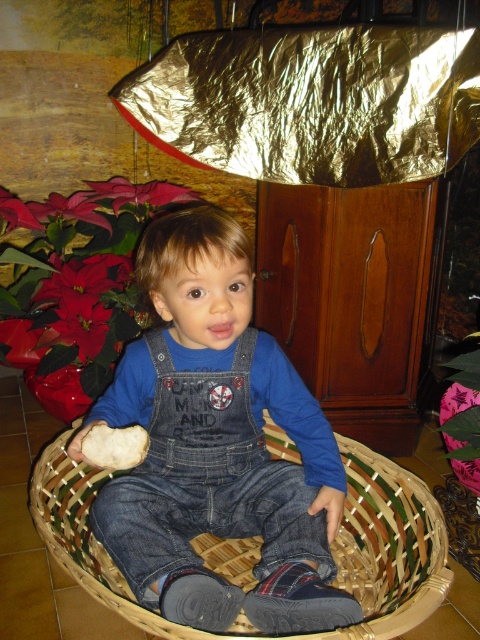
Based on the scene description, where is the denim overalls at center located in terms of coordinates?

The denim overalls at center is located at point coordinates of (216, 445).

You are a parent looking at the image and want to ensure the child is safe. Since the child is in the woven wood basket at center and wearing denim overalls at center, which object is closer to you to check if the child is secure?

The denim overalls at center is closer to you than the woven wood basket at center, so you should check the denim overalls at center first to ensure the child is secure.

You are a photographer setting up a shot of the child in the woven wood basket at center. The denim overalls at center are part of the scene. Considering their sizes, which object would likely require more space in the foreground to capture fully?

The denim overalls at center is much taller than the woven wood basket at center, so it would require more foreground space to capture fully.